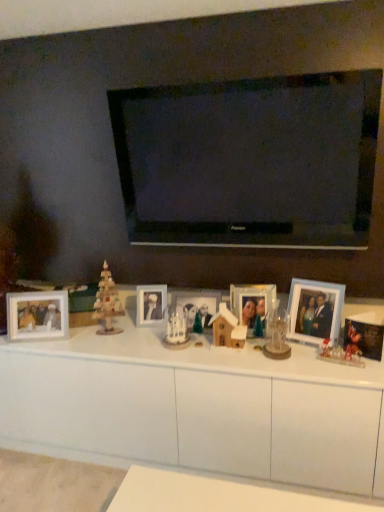
Identify the location of free spot to the left of wooden house at center, acting as the second toy starting from the front. (187, 356).